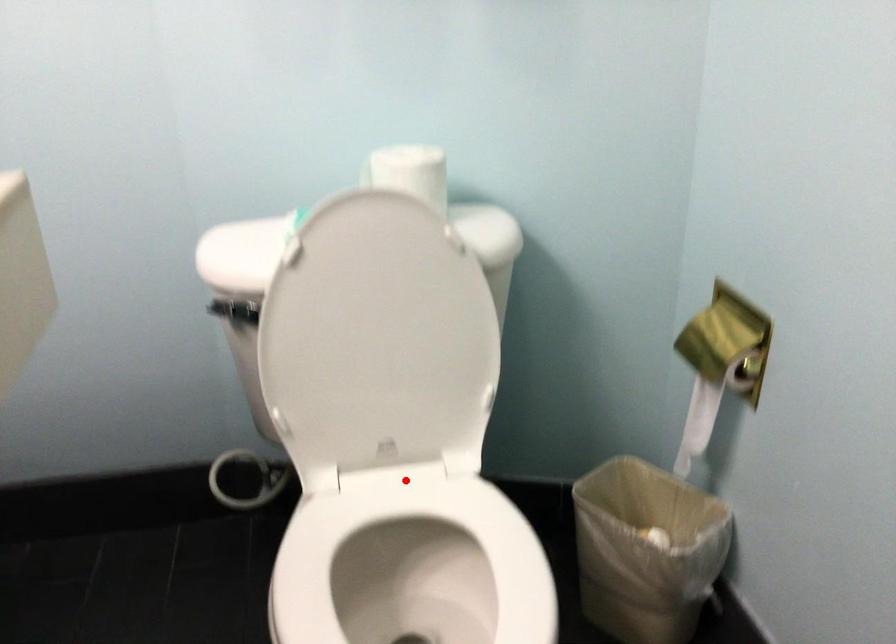
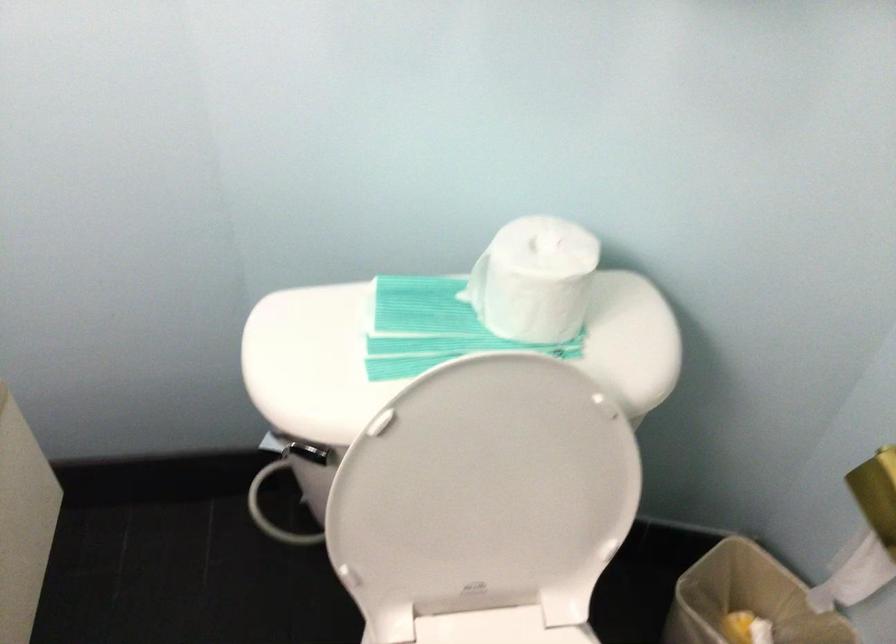
Question: I am providing you with two images of the same scene from different viewpoints. A red point is shown in image1. For the corresponding object point in image2, is it positioned nearer or farther from the camera?

Choices:
 (A) Nearer
 (B) Farther

Answer: (A)